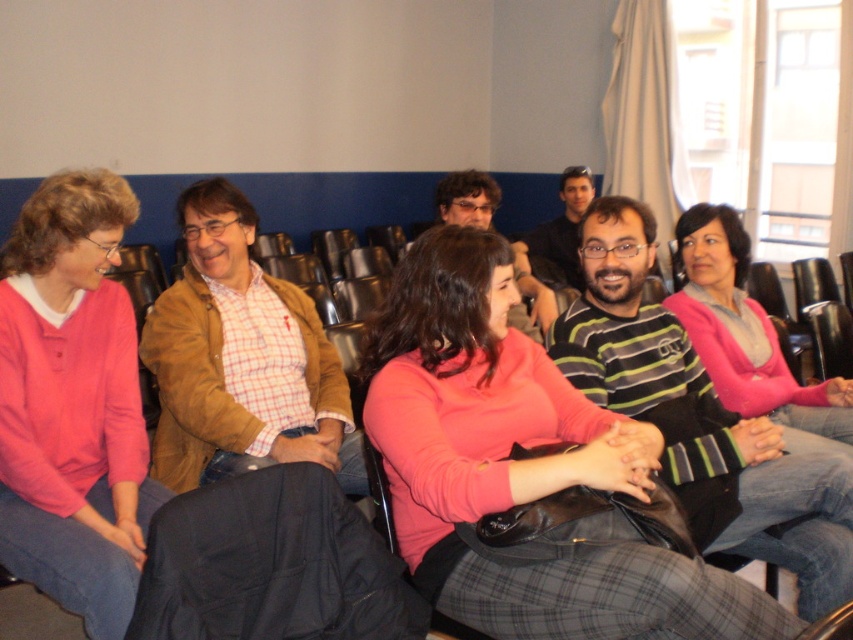
You are standing in the classroom and want to hand a note to the person wearing the brown leather jacket at center. Based on their position in the room, where should you look to find them?

The brown leather jacket at center is located at the 2D coordinates point (241, 358), which is in the center of the image. So you should look towards the center of the classroom to find them.

You are standing in the classroom and want to know how far the point at coordinates (779, 372) is from you. Can you determine the distance?

The point at coordinates (779, 372) is 2.55 meters away from the camera, so the distance from you to that point is approximately 2.55 meters.

From the picture: You are sitting in the front row of the classroom and want to see the whiteboard at the front. There are two jackets in your view, the brown leather jacket at center and the black fabric jacket at lower center. Which jacket is blocking your view more?

The black fabric jacket at lower center is behind the brown leather jacket at center, so the brown leather jacket at center is blocking your view more because it is in front of the black fabric jacket at lower center.